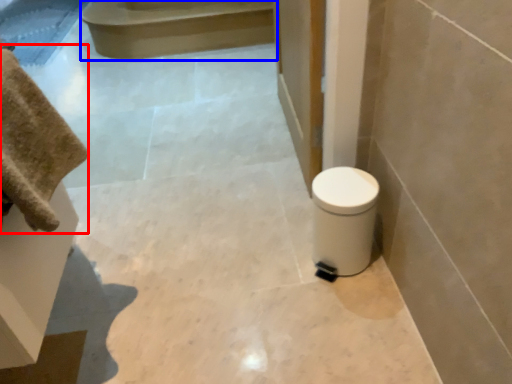
Question: Which point is further to the camera, bath towel (highlighted by a red box) or stair (highlighted by a blue box)?

Choices:
 (A) bath towel
 (B) stair

Answer: (B)